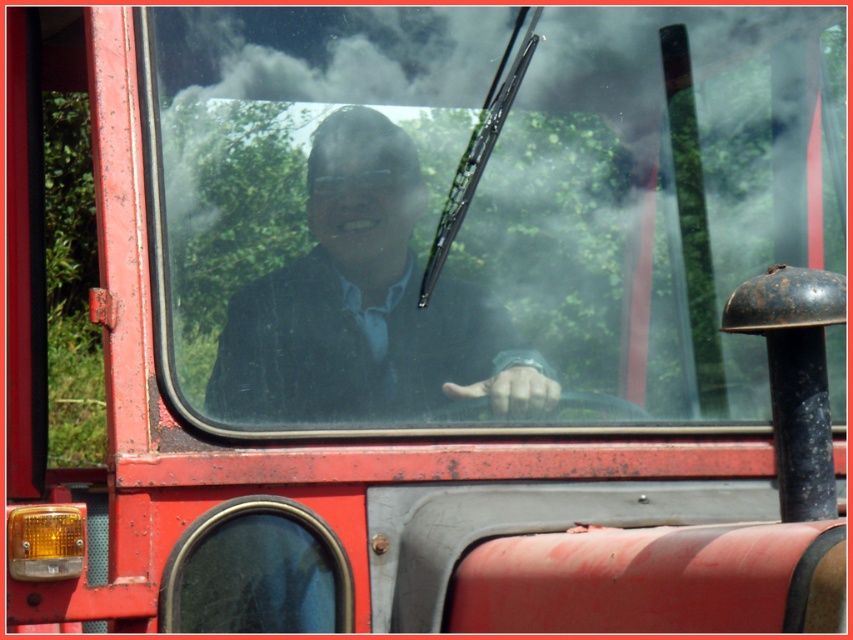
Can you confirm if clear glass windshield at center is taller than matte black suit at center?

Indeed, clear glass windshield at center has a greater height compared to matte black suit at center.

Is the position of clear glass windshield at center more distant than that of matte black suit at center?

No, it is in front of matte black suit at center.

Which is behind, point (759, 145) or point (318, 244)?

Point (759, 145)

Find the location of `clear glass windshield at center`. clear glass windshield at center is located at coordinates (485, 211).